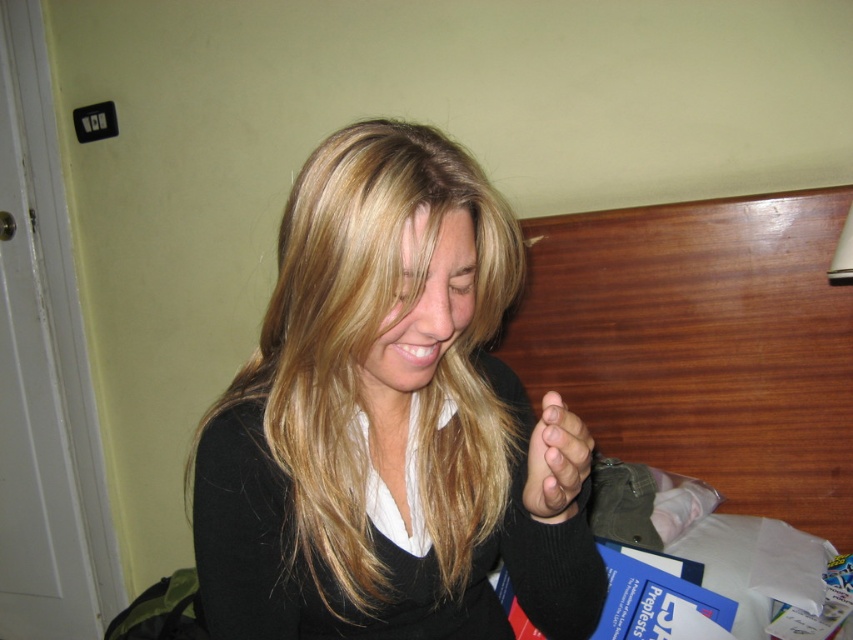
Identify the location of smooth black sweater at center. (381, 419).

Is smooth black sweater at center to the left of smooth skin hand at center from the viewer's perspective?

Indeed, smooth black sweater at center is positioned on the left side of smooth skin hand at center.

This screenshot has width=853, height=640. Identify the location of smooth black sweater at center. (381, 419).

Find the location of a particular element. The width and height of the screenshot is (853, 640). smooth black sweater at center is located at coordinates (381, 419).